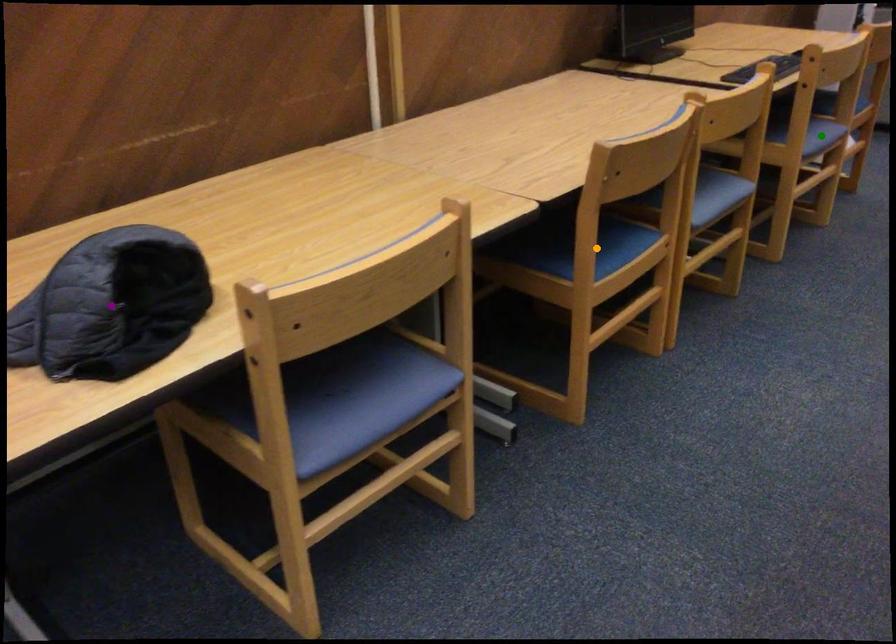
Order these from farthest to nearest:
A) green point
B) purple point
C) orange point

green point < orange point < purple point